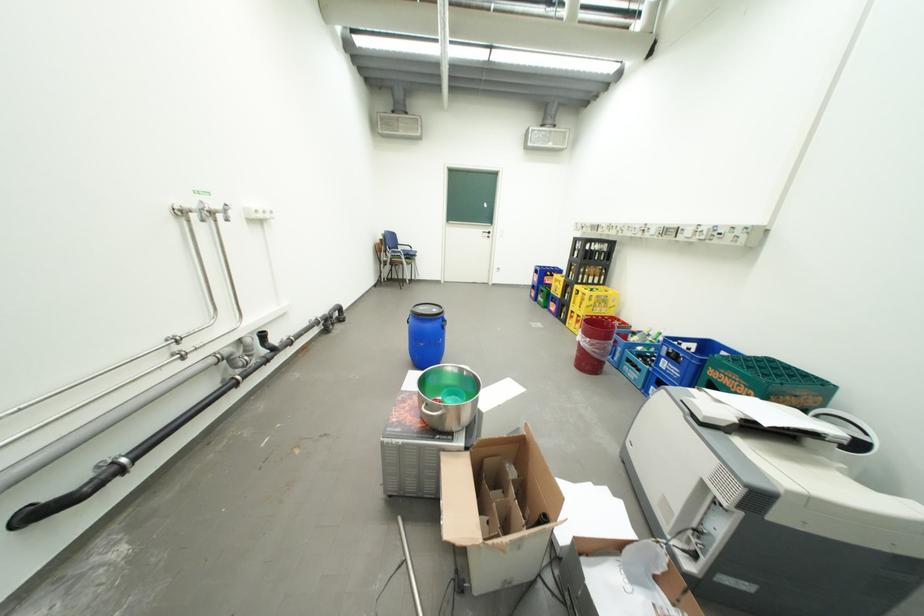
Which object does [682,361] point to?

It corresponds to the blue bottle crate in the image.